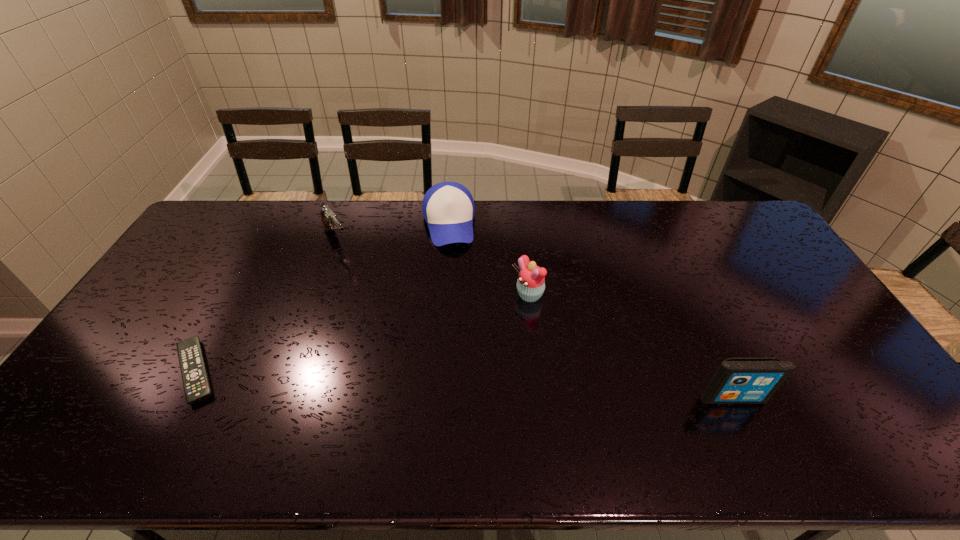
Identify the location of free space located 0.250m on the face of the second object from right to left. The width and height of the screenshot is (960, 540). (448, 345).

You are a GUI agent. You are given a task and a screenshot of the screen. Output one action in this format:
    pyautogui.click(x=<x>, y=<y>)
    Task: Click on the vacant area situated 0.100m on the front-facing side of the third object from left to right
    The width and height of the screenshot is (960, 540).
    Given the screenshot: What is the action you would take?
    pyautogui.click(x=451, y=270)

Find the location of a particular element. free space located 0.310m on the front-facing side of the third object from left to right is located at coordinates (455, 319).

Find the location of a particular element. This screenshot has width=960, height=540. vacant space located 0.150m on the front-facing side of the third object from left to right is located at coordinates (452, 281).

Find the location of `vacant space located at the barrel of the second object from left to right`. vacant space located at the barrel of the second object from left to right is located at coordinates (356, 272).

You are a GUI agent. You are given a task and a screenshot of the screen. Output one action in this format:
    pyautogui.click(x=<x>, y=<y>)
    Task: Click on the free region located 0.090m at the barrel of the second object from left to right
    The width and height of the screenshot is (960, 540).
    Given the screenshot: What is the action you would take?
    pyautogui.click(x=353, y=268)

Locate an element on the screen. This screenshot has width=960, height=540. free space located 0.260m at the barrel of the second object from left to right is located at coordinates (375, 299).

The width and height of the screenshot is (960, 540). I want to click on baseball cap present at the far edge, so click(448, 208).

The width and height of the screenshot is (960, 540). I want to click on pistol present at the far edge, so click(329, 219).

At what (x,y) coordinates should I click in order to perform the action: click on remote control at the near edge. Please return your answer as a coordinate pair (x, y). This screenshot has height=540, width=960. Looking at the image, I should click on (196, 384).